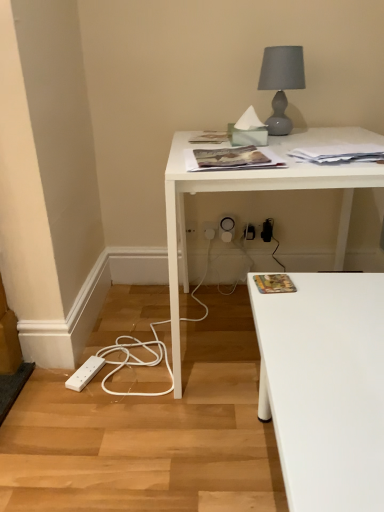
The width and height of the screenshot is (384, 512). I want to click on vacant region to the left of white plastic extension cord at lower left, so tap(48, 384).